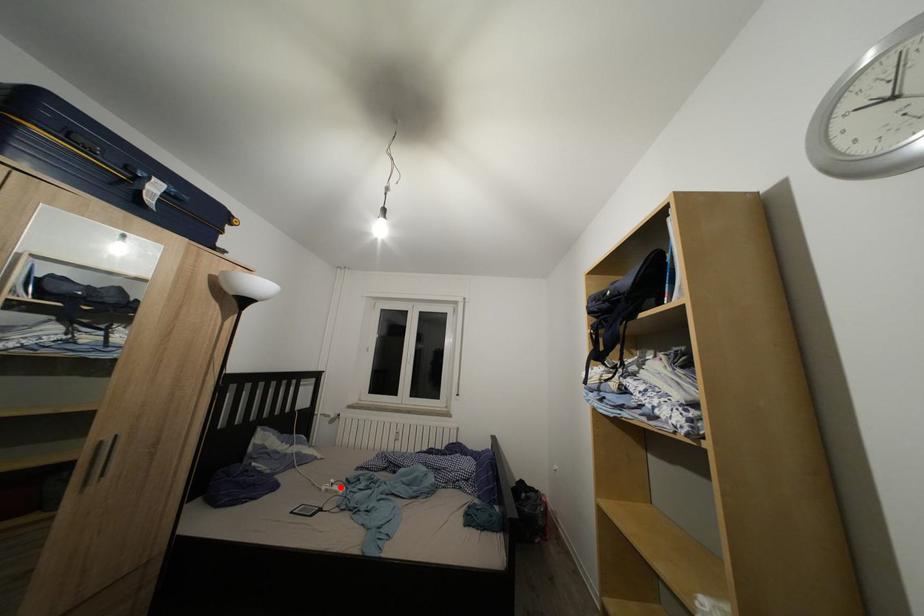
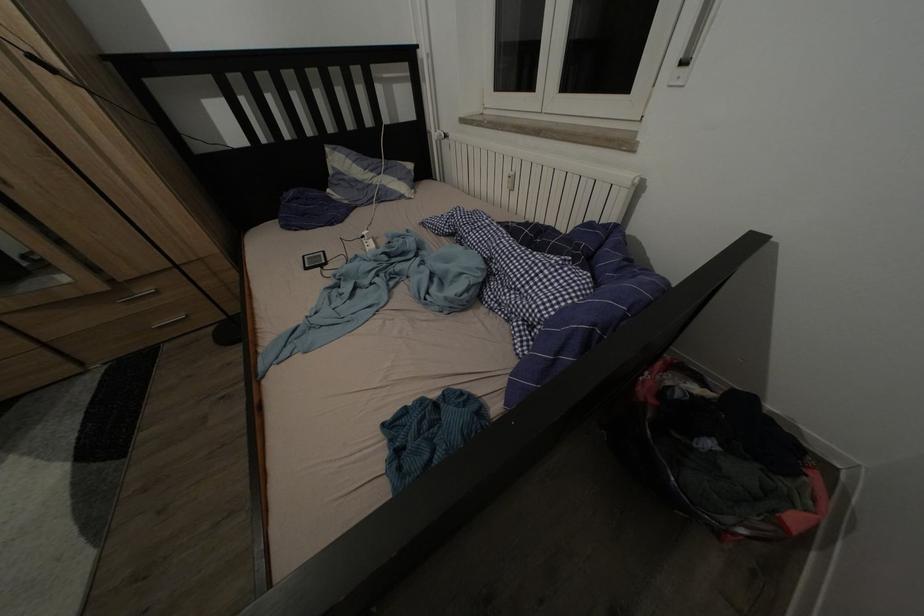
Find the pixel in the second image that matches the highlighted location in the first image.

(372, 238)